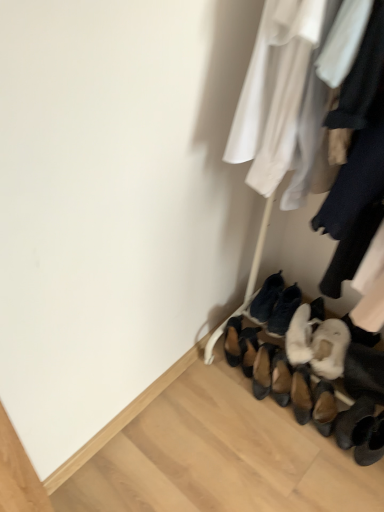
Question: Is brown suede shoes at lower center, placed as the second footwear when sorted from left to right, located outside black suede shoes at lower center, marked as the 3th footwear in a left-to-right arrangement?

Choices:
 (A) yes
 (B) no

Answer: (A)

Question: Is brown suede shoes at lower center, placed as the second footwear when sorted from left to right, bigger than black suede shoes at lower center, marked as the 3th footwear in a left-to-right arrangement?

Choices:
 (A) yes
 (B) no

Answer: (B)

Question: Is black suede shoes at lower center, acting as the 4th footwear starting from the right, at the back of brown suede shoes at lower center, the fifth footwear in the right-to-left sequence?

Choices:
 (A) yes
 (B) no

Answer: (A)

Question: From a real-world perspective, is brown suede shoes at lower center, the fifth footwear in the right-to-left sequence, physically below black suede shoes at lower center, marked as the 3th footwear in a left-to-right arrangement?

Choices:
 (A) yes
 (B) no

Answer: (A)

Question: Does brown suede shoes at lower center, the fifth footwear in the right-to-left sequence, appear on the right side of black suede shoes at lower center, marked as the 3th footwear in a left-to-right arrangement?

Choices:
 (A) yes
 (B) no

Answer: (B)

Question: Which is correct: black suede shoes at lower center, marked as the 3th footwear in a left-to-right arrangement, is inside fuzzy white slippers at center, marked as the 4th footwear in a left-to-right arrangement, or outside of it?

Choices:
 (A) outside
 (B) inside

Answer: (B)

Question: Considering the positions of point (273, 279) and point (284, 327), is point (273, 279) closer or farther from the camera than point (284, 327)?

Choices:
 (A) closer
 (B) farther

Answer: (B)

Question: From a real-world perspective, is black suede shoes at lower center, acting as the 4th footwear starting from the right, physically located above or below fuzzy white slippers at center, marked as the 4th footwear in a left-to-right arrangement?

Choices:
 (A) below
 (B) above

Answer: (A)

Question: Would you say black suede shoes at lower center, acting as the 4th footwear starting from the right, is to the left or to the right of fuzzy white slippers at center, marked as the 4th footwear in a left-to-right arrangement, in the picture?

Choices:
 (A) right
 (B) left

Answer: (B)

Question: Based on their sizes in the image, would you say white fur boot at lower right, the 2th footwear viewed from the right, is bigger or smaller than brown suede shoes at lower center, the first footwear viewed from the left?

Choices:
 (A) small
 (B) big

Answer: (B)

Question: From a real-world perspective, is white fur boot at lower right, the 2th footwear viewed from the right, above or below brown suede shoes at lower center, arranged as the sixth footwear when viewed from the right?

Choices:
 (A) below
 (B) above

Answer: (B)

Question: Which is correct: white fur boot at lower right, the fifth footwear in the left-to-right sequence, is inside brown suede shoes at lower center, arranged as the sixth footwear when viewed from the right, or outside of it?

Choices:
 (A) outside
 (B) inside

Answer: (A)

Question: In the image, is white fur boot at lower right, the fifth footwear in the left-to-right sequence, positioned in front of or behind brown suede shoes at lower center, the first footwear viewed from the left?

Choices:
 (A) behind
 (B) front

Answer: (B)

Question: Choose the correct answer: Is brown suede shoes at lower center, the first footwear viewed from the left, inside fuzzy white slippers at center, marked as the 4th footwear in a left-to-right arrangement, or outside it?

Choices:
 (A) inside
 (B) outside

Answer: (B)

Question: Does point (225, 350) appear closer or farther from the camera than point (286, 302)?

Choices:
 (A) closer
 (B) farther

Answer: (B)